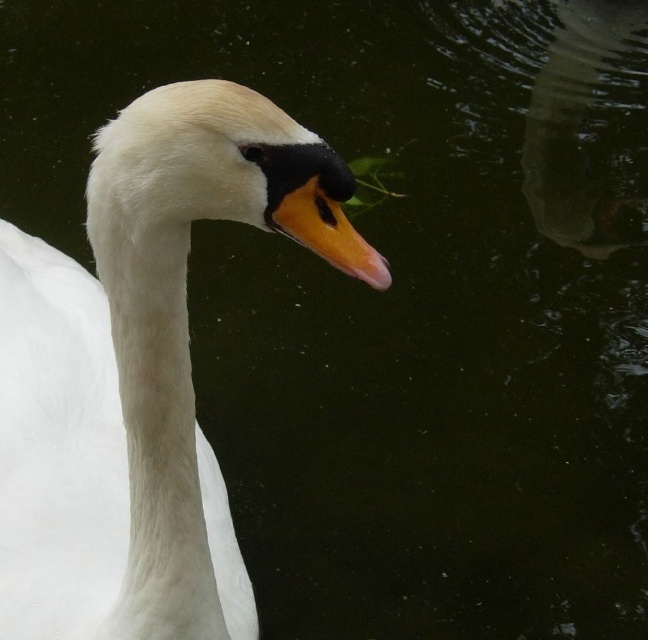
From the picture: Is white feathered swan at center positioned at the back of orange glossy beak at center?

Yes, white feathered swan at center is further from the viewer.

Does white feathered swan at center have a smaller size compared to orange glossy beak at center?

Actually, white feathered swan at center might be larger than orange glossy beak at center.

Describe the element at coordinates (141, 371) in the screenshot. I see `white feathered swan at center` at that location.

Locate an element on the screen. Image resolution: width=648 pixels, height=640 pixels. white feathered swan at center is located at coordinates (141, 371).